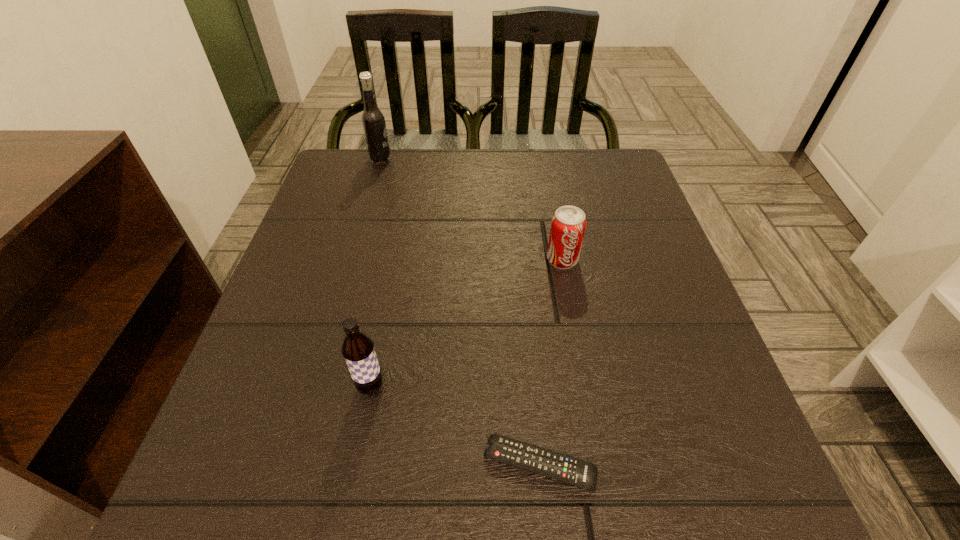
This screenshot has height=540, width=960. Find the location of `the tallest object`. the tallest object is located at coordinates (373, 120).

Find the location of a particular element. The height and width of the screenshot is (540, 960). the taller root beer is located at coordinates (373, 120).

At what (x,y) coordinates should I click in order to perform the action: click on the nearer root beer. Please return your answer as a coordinate pair (x, y). The image size is (960, 540). Looking at the image, I should click on (358, 350).

Locate an element on the screen. Image resolution: width=960 pixels, height=540 pixels. the third shortest object is located at coordinates (358, 350).

Find the location of a particular element. This screenshot has width=960, height=540. soda can is located at coordinates (568, 224).

This screenshot has width=960, height=540. What are the coordinates of `the second shortest object` in the screenshot? It's located at (568, 224).

The image size is (960, 540). I want to click on the shortest object, so [x=545, y=462].

You are a GUI agent. You are given a task and a screenshot of the screen. Output one action in this format:
    pyautogui.click(x=<x>, y=<y>)
    Task: Click on the nearest object
    This screenshot has height=540, width=960.
    Given the screenshot: What is the action you would take?
    pyautogui.click(x=545, y=462)

The height and width of the screenshot is (540, 960). I want to click on free point located 0.240m on the label of the taller root beer, so click(479, 160).

Identify the location of free spot located 0.320m on the right of the second object from left to right. (581, 387).